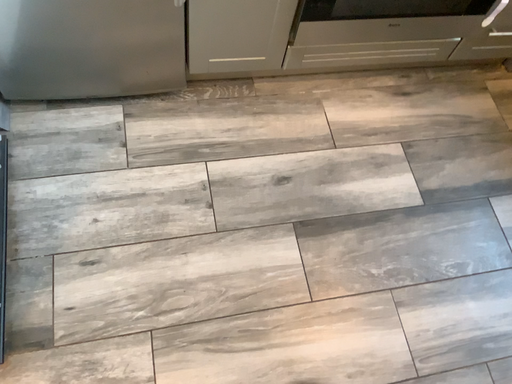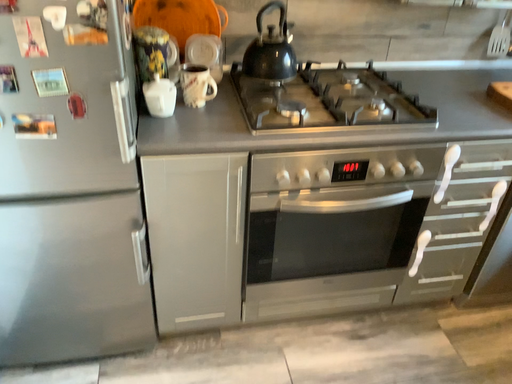
Question: Which way did the camera rotate in the video?

Choices:
 (A) rotated upward
 (B) rotated downward

Answer: (A)